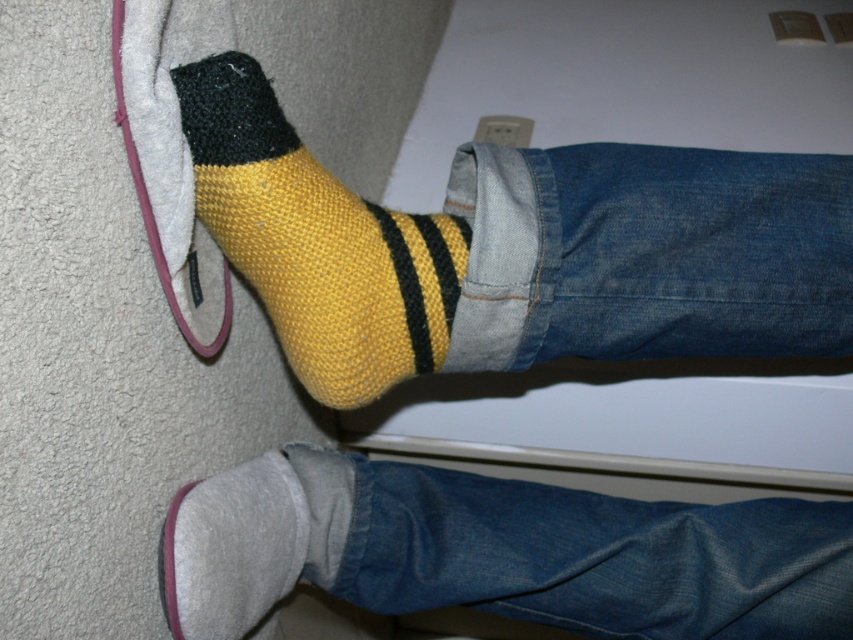
You are trying to find the yellow knitted sock at lower left in the image. According to the scene description, where exactly is it positioned?

The yellow knitted sock at lower left is located at point (316, 241).